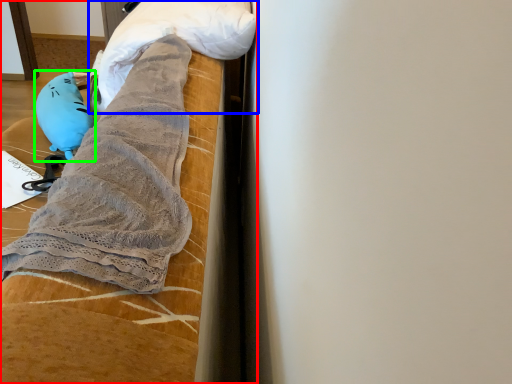
Question: Estimate the real-world distances between objects in this image. Which object is closer to furniture (highlighted by a red box), wrap (highlighted by a blue box) or toy (highlighted by a green box)?

Choices:
 (A) wrap
 (B) toy

Answer: (A)